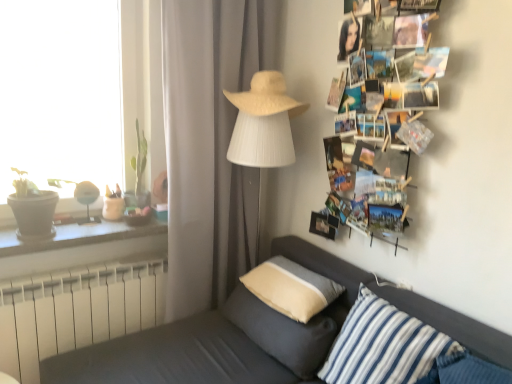
Question: From the image's perspective, is dark gray fabric couch at lower left positioned above or below printed paper collage at upper right?

Choices:
 (A) above
 (B) below

Answer: (B)

Question: Looking at their shapes, would you say dark gray fabric couch at lower left is wider or thinner than printed paper collage at upper right?

Choices:
 (A) wide
 (B) thin

Answer: (A)

Question: Which object is positioned closest to the white plastic radiator at lower left?

Choices:
 (A) beige fabric pillow at center, acting as the 2th pillow starting from the front
 (B) white fabric lampshade at center
 (C) printed paper collage at upper right
 (D) blue striped fabric pillow at lower right, the first pillow positioned from the front
 (E) dark gray concrete window sill at left

Answer: (E)

Question: Based on their relative distances, which object is farther from the beige fabric pillow at center, placed as the second pillow when sorted from back to front?

Choices:
 (A) printed paper collage at upper right
 (B) white plastic radiator at lower left
 (C) dark gray concrete window sill at left
 (D) dark gray fabric couch at lower left
 (E) white woven hat at upper center

Answer: (E)